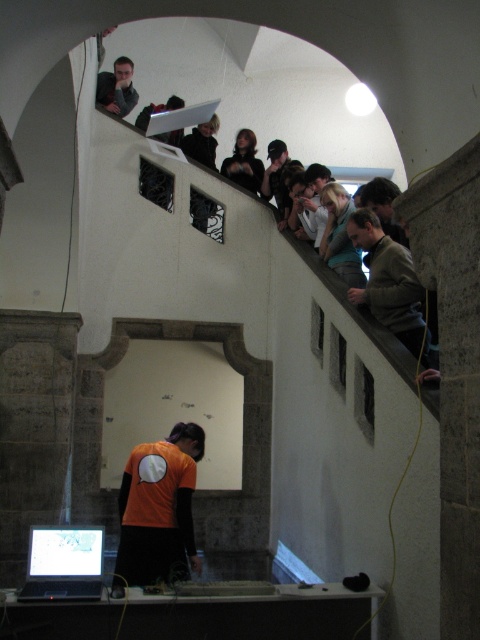
Question: Is orange jersey at lower center behind matte gray shirt at upper left?

Choices:
 (A) no
 (B) yes

Answer: (A)

Question: Which point is farther to the camera?

Choices:
 (A) (101, 92)
 (B) (96, 568)
 (C) (149, 554)

Answer: (A)

Question: Which object appears closest to the camera in this image?

Choices:
 (A) matte black laptop at lower left
 (B) dark gray sweater at upper right
 (C) matte gray shirt at upper left

Answer: (A)

Question: Is dark gray sweater at upper right smaller than matte black laptop at lower left?

Choices:
 (A) yes
 (B) no

Answer: (B)

Question: Does orange jersey at lower center appear on the left side of dark gray sweater at upper right?

Choices:
 (A) no
 (B) yes

Answer: (B)

Question: Which object is positioned farthest from the matte black laptop at lower left?

Choices:
 (A) orange jersey at lower center
 (B) dark gray sweater at upper right

Answer: (B)